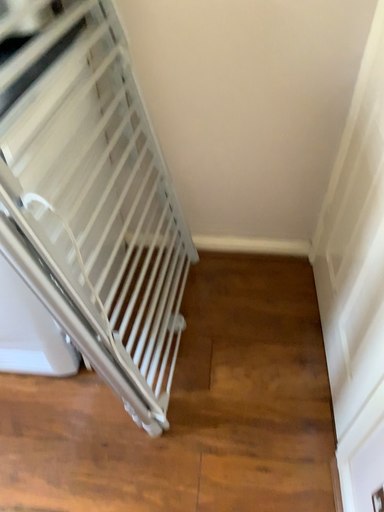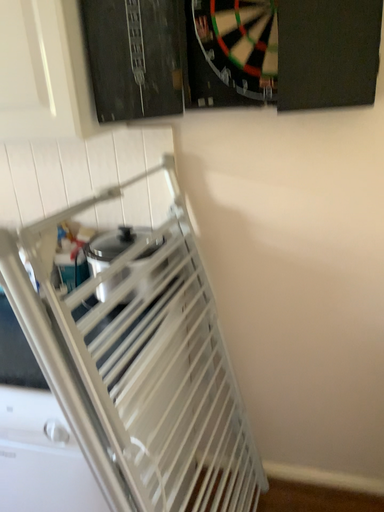
Question: Which way did the camera rotate in the video?

Choices:
 (A) rotated upward
 (B) rotated downward

Answer: (A)